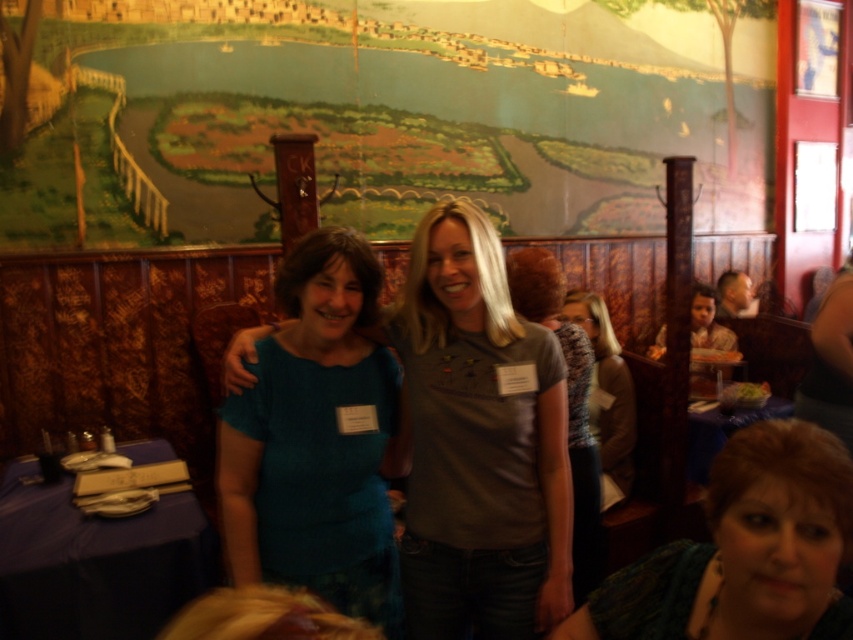
Question: Does green painted wall at upper center come in front of green textured blouse at lower right?

Choices:
 (A) no
 (B) yes

Answer: (A)

Question: Is teal fabric shirt at center wider than gray textured sweater at center?

Choices:
 (A) yes
 (B) no

Answer: (A)

Question: Is green textured blouse at lower right smaller than gray textured sweater at center?

Choices:
 (A) no
 (B) yes

Answer: (B)

Question: Considering the real-world distances, which object is farthest from the gray textured sweater at center?

Choices:
 (A) green textured blouse at lower right
 (B) matte gray shirt at center
 (C) teal knit sweater at center

Answer: (A)

Question: Which of the following is the closest to the observer?

Choices:
 (A) (602, 387)
 (B) (825, 513)
 (C) (479, 600)
 (D) (570, 362)

Answer: (B)

Question: Which point is farther to the camera?

Choices:
 (A) (610, 470)
 (B) (755, 602)

Answer: (A)